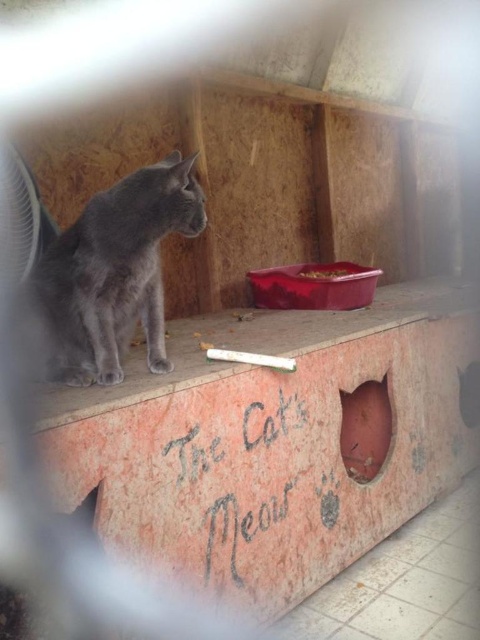
You are standing in front of a cat shelter and want to place a small bowl of water for the cat. The platform where the cat is sitting is at point (277, 440). Where should you place the bowl so that it is directly in front of the cat?

The rustic concrete ledge at center is located at point (277, 440), so you should place the bowl directly in front of that point to ensure it is in front of the cat.

You are standing in front of the shelter where the gray cat is sitting. Where exactly is the rustic concrete ledge at center located in terms of coordinates?

The rustic concrete ledge at center is located at point [277,440].